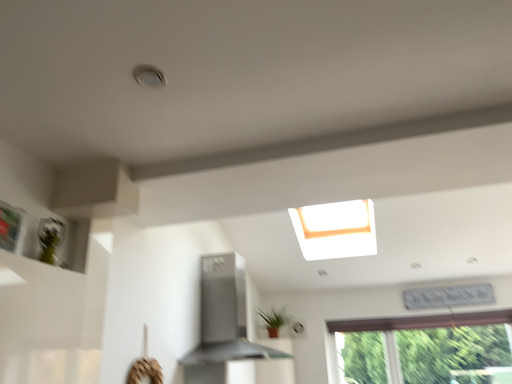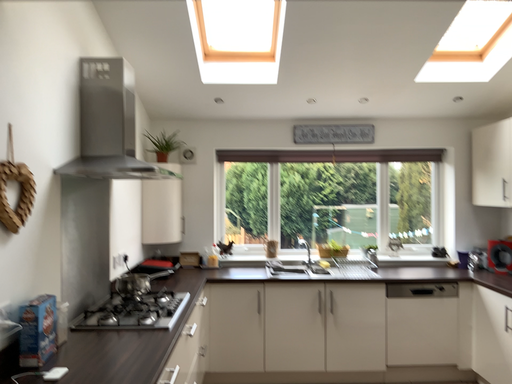
Question: Which way did the camera rotate in the video?

Choices:
 (A) rotated right
 (B) rotated left

Answer: (A)